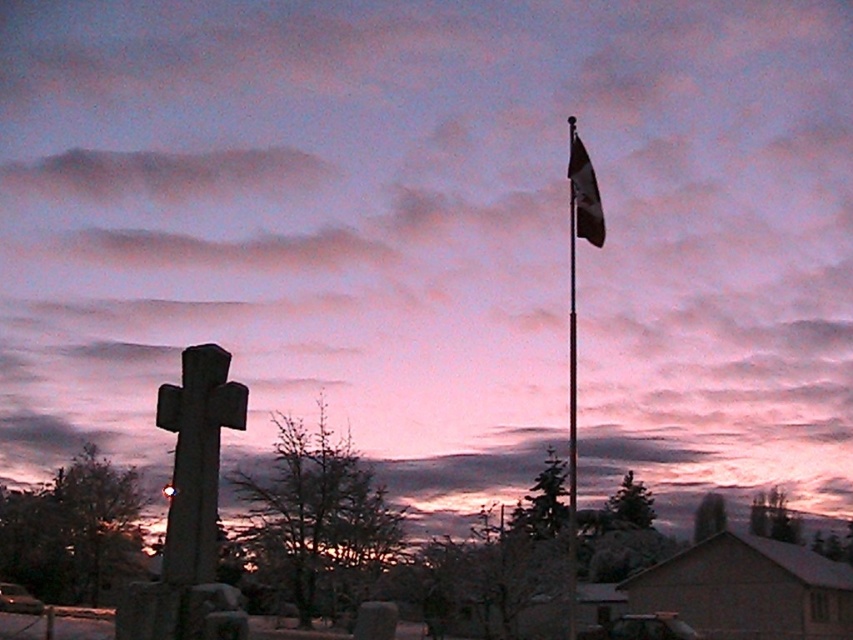
Question: Does metallic pole at upper right have a greater width compared to metallic flagpole at right?

Choices:
 (A) no
 (B) yes

Answer: (A)

Question: Which object appears closest to the camera in this image?

Choices:
 (A) dark blue fabric flag at upper right
 (B) metallic pole at upper right

Answer: (B)

Question: Is metallic flagpole at right below dark blue fabric flag at upper right?

Choices:
 (A) no
 (B) yes

Answer: (B)

Question: Which object is farther from the camera taking this photo?

Choices:
 (A) dark blue fabric flag at upper right
 (B) metallic flagpole at right

Answer: (A)

Question: Considering the real-world distances, which object is farthest from the dark blue fabric flag at upper right?

Choices:
 (A) metallic pole at upper right
 (B) metallic flagpole at right

Answer: (B)

Question: Does metallic pole at upper right appear on the right side of metallic flagpole at right?

Choices:
 (A) yes
 (B) no

Answer: (B)